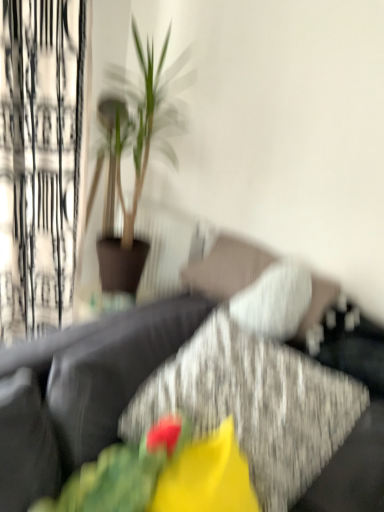
Question: Would you say green leafy plant at upper left contains matte yellow flower at center?

Choices:
 (A) yes
 (B) no

Answer: (B)

Question: Can you confirm if green leafy plant at upper left is bigger than matte yellow flower at center?

Choices:
 (A) yes
 (B) no

Answer: (A)

Question: From a real-world perspective, does green leafy plant at upper left sit lower than matte yellow flower at center?

Choices:
 (A) no
 (B) yes

Answer: (A)

Question: From the image's perspective, is green leafy plant at upper left located above matte yellow flower at center?

Choices:
 (A) yes
 (B) no

Answer: (A)

Question: From a real-world perspective, does green leafy plant at upper left stand above matte yellow flower at center?

Choices:
 (A) no
 (B) yes

Answer: (B)

Question: From the image's perspective, relative to fluffy fabric flower at center, is white sheer curtain at left above or below?

Choices:
 (A) below
 (B) above

Answer: (B)

Question: In terms of width, does white sheer curtain at left look wider or thinner when compared to fluffy fabric flower at center?

Choices:
 (A) wide
 (B) thin

Answer: (B)

Question: Looking at the image, does white sheer curtain at left seem bigger or smaller compared to fluffy fabric flower at center?

Choices:
 (A) small
 (B) big

Answer: (B)

Question: Does point (x=38, y=69) appear closer or farther from the camera than point (x=182, y=481)?

Choices:
 (A) farther
 (B) closer

Answer: (A)

Question: Is point (86, 464) positioned closer to the camera than point (231, 503)?

Choices:
 (A) farther
 (B) closer

Answer: (A)

Question: Is fluffy fabric flower at center situated inside matte yellow flower at center or outside?

Choices:
 (A) outside
 (B) inside

Answer: (A)

Question: From the image's perspective, is fluffy fabric flower at center located above or below matte yellow flower at center?

Choices:
 (A) below
 (B) above

Answer: (B)

Question: From a real-world perspective, relative to matte yellow flower at center, is fluffy fabric flower at center vertically above or below?

Choices:
 (A) above
 (B) below

Answer: (A)

Question: Is point (18, 442) closer or farther from the camera than point (124, 128)?

Choices:
 (A) farther
 (B) closer

Answer: (B)

Question: From the image's perspective, is textured gray couch at center above or below green leafy plant at upper left?

Choices:
 (A) below
 (B) above

Answer: (A)